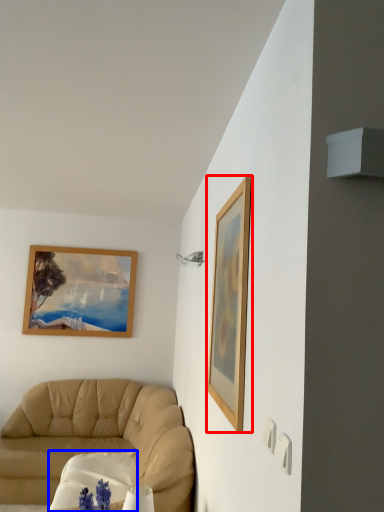
Question: Which object appears farthest to the camera in this image, picture frame (highlighted by a red box) or round table (highlighted by a blue box)?

Choices:
 (A) picture frame
 (B) round table

Answer: (B)